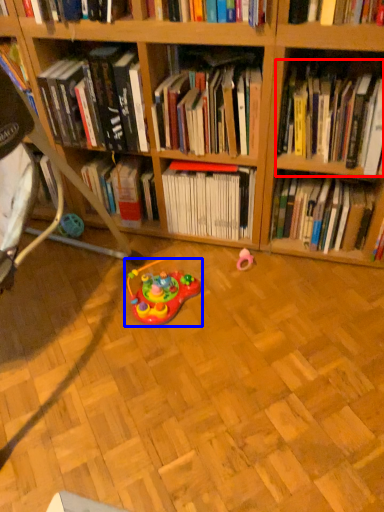
Question: Among these objects, which one is farthest to the camera, book (highlighted by a red box) or toy (highlighted by a blue box)?

Choices:
 (A) book
 (B) toy

Answer: (B)